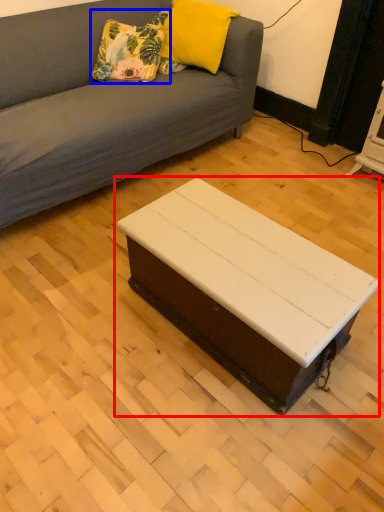
Question: Which object is closer to the camera taking this photo, coffee table (highlighted by a red box) or pillow (highlighted by a blue box)?

Choices:
 (A) coffee table
 (B) pillow

Answer: (A)